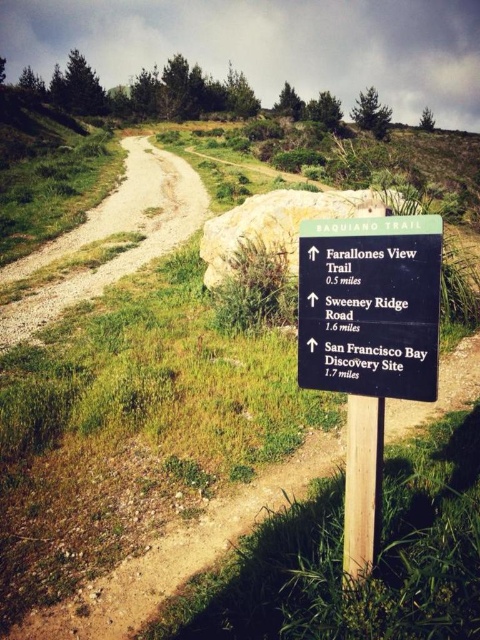
Question: Is the position of black plastic sign at center more distant than that of gravelly dirt trail at left?

Choices:
 (A) no
 (B) yes

Answer: (A)

Question: Which point appears closest to the camera in this image?

Choices:
 (A) (427, 316)
 (B) (3, 308)

Answer: (A)

Question: Can you confirm if black plastic sign at center is positioned to the right of gravelly dirt trail at left?

Choices:
 (A) no
 (B) yes

Answer: (B)

Question: Which object appears farthest from the camera in this image?

Choices:
 (A) black plastic sign at center
 (B) gravelly dirt trail at left

Answer: (B)

Question: Can you confirm if black plastic sign at center is wider than gravelly dirt trail at left?

Choices:
 (A) no
 (B) yes

Answer: (A)